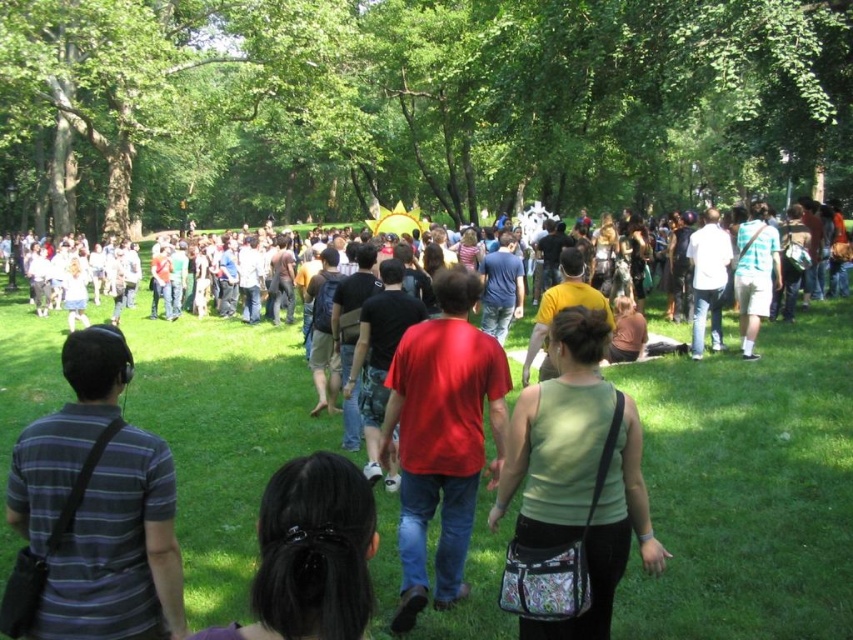
Based on the photo, you are standing in the park and see the green fabric purse at center and the light blue shirt at center. Which object is closer to the ground?

The green fabric purse at center is below the light blue shirt at center, so it is closer to the ground.

You are standing at the edge of the park and see the matte black shirt at center and the black hair at center. Which one is closer to you?

The matte black shirt at center is positioned under black hair at center, so the black hair at center is closer to you.